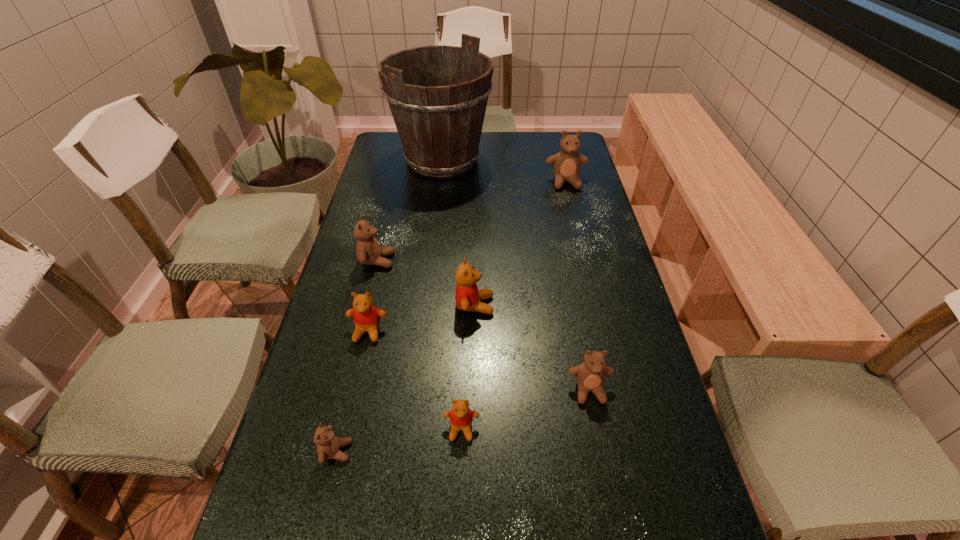
The height and width of the screenshot is (540, 960). I want to click on the tallest object, so 439,123.

Locate an element on the screen. This screenshot has height=540, width=960. the biggest brown teddy bear is located at coordinates (566, 164).

Where is `the seventh shortest object`? The image size is (960, 540). the seventh shortest object is located at coordinates (566, 164).

Where is `the second farthest brown teddy bear`? The image size is (960, 540). the second farthest brown teddy bear is located at coordinates (368, 251).

Find the location of a particular element. This screenshot has width=960, height=540. the sixth nearest teddy bear is located at coordinates (368, 251).

The height and width of the screenshot is (540, 960). Find the location of `the biggest red teddy bear`. the biggest red teddy bear is located at coordinates (467, 296).

Locate an element on the screen. Image resolution: width=960 pixels, height=540 pixels. the second biggest red teddy bear is located at coordinates (366, 316).

Locate an element on the screen. The image size is (960, 540). the fifth farthest teddy bear is located at coordinates (590, 375).

Where is `the third nearest object`? This screenshot has width=960, height=540. the third nearest object is located at coordinates (590, 375).

In order to click on the nearest brown teddy bear in this screenshot , I will do `click(328, 445)`.